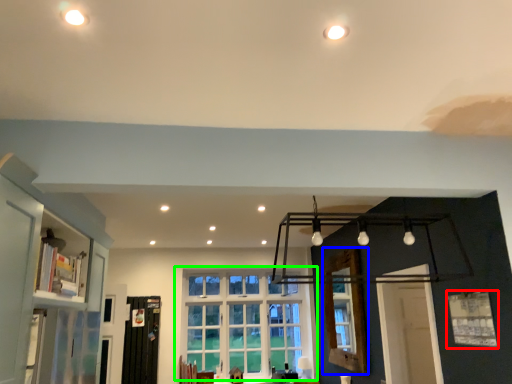
Question: Considering the real-world distances, which object is farthest from window (highlighted by a red box)? window frame (highlighted by a blue box) or window (highlighted by a green box)?

Choices:
 (A) window frame
 (B) window

Answer: (B)